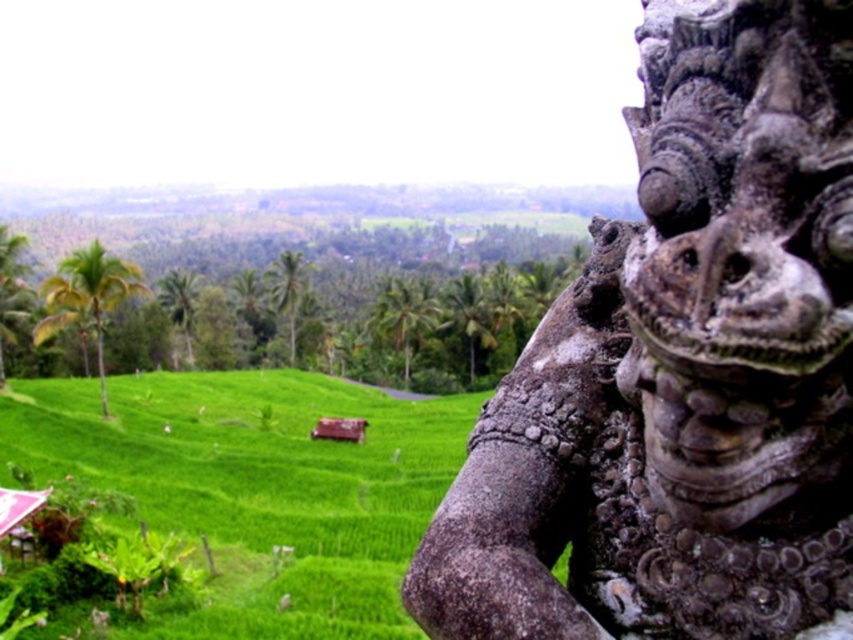
Does gray stone statue at right have a lesser height compared to green grassy hillside at lower left?

Yes.

Does point (798, 516) come farther from viewer compared to point (398, 500)?

No, (798, 516) is closer to viewer.

At what (x,y) coordinates should I click in order to perform the action: click on gray stone statue at right. Please return your answer as a coordinate pair (x, y). The image size is (853, 640). Looking at the image, I should click on (682, 369).

This screenshot has width=853, height=640. Identify the location of gray stone statue at right. (682, 369).